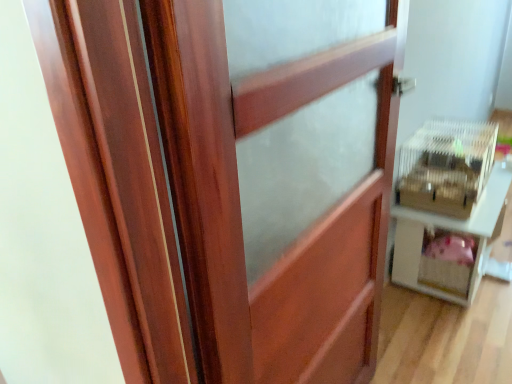
Question: From a real-world perspective, is white plastic cage at right below wooden barn door at center?

Choices:
 (A) no
 (B) yes

Answer: (B)

Question: Is white plastic cage at right far away from wooden barn door at center?

Choices:
 (A) no
 (B) yes

Answer: (A)

Question: Could you tell me if white plastic cage at right is turned towards wooden barn door at center?

Choices:
 (A) yes
 (B) no

Answer: (B)

Question: Is white plastic cage at right to the right of wooden barn door at center from the viewer's perspective?

Choices:
 (A) yes
 (B) no

Answer: (A)

Question: Is white plastic cage at right further to the viewer compared to wooden barn door at center?

Choices:
 (A) yes
 (B) no

Answer: (A)

Question: In terms of height, does wooden barn door at center look taller or shorter compared to white plastic cage at right?

Choices:
 (A) short
 (B) tall

Answer: (B)

Question: Is wooden barn door at center inside the boundaries of white plastic cage at right, or outside?

Choices:
 (A) inside
 (B) outside

Answer: (B)

Question: From a real-world perspective, is wooden barn door at center positioned above or below white plastic cage at right?

Choices:
 (A) below
 (B) above

Answer: (B)

Question: Considering the positions of point (326, 334) and point (452, 294), is point (326, 334) closer or farther from the camera than point (452, 294)?

Choices:
 (A) closer
 (B) farther

Answer: (A)

Question: Is point (440, 152) closer or farther from the camera than point (292, 299)?

Choices:
 (A) closer
 (B) farther

Answer: (B)

Question: In the image, is clear plastic crate at right positioned in front of or behind wooden barn door at center?

Choices:
 (A) front
 (B) behind

Answer: (B)

Question: Is clear plastic crate at right wider or thinner than wooden barn door at center?

Choices:
 (A) thin
 (B) wide

Answer: (B)

Question: Considering the positions of clear plastic crate at right and wooden barn door at center in the image, is clear plastic crate at right taller or shorter than wooden barn door at center?

Choices:
 (A) short
 (B) tall

Answer: (A)

Question: Is point (441, 167) closer or farther from the camera than point (476, 273)?

Choices:
 (A) farther
 (B) closer

Answer: (A)

Question: From the image's perspective, is clear plastic crate at right above or below white plastic cage at right?

Choices:
 (A) above
 (B) below

Answer: (A)